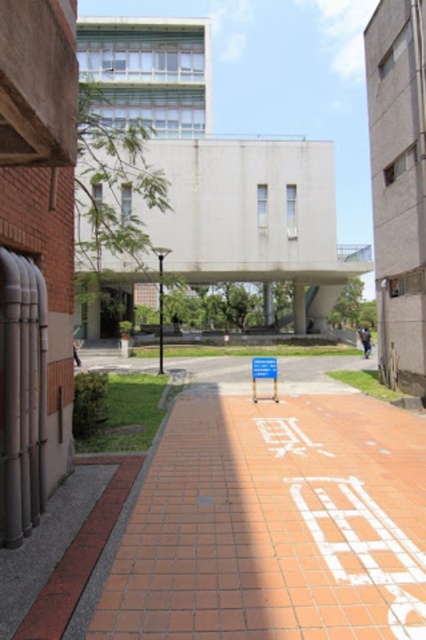
You are a maintenance worker needing to place a 10 meter long hose between the white painted brick at center and the blue plastic sign at center. Can you fit the hose between them without bending it?

The distance between the white painted brick at center and the blue plastic sign at center is 9.32 meters. Since the hose is 10 meters long, it is longer than the distance between them. Therefore, the hose cannot be placed straight between them without bending.

You are standing at the center of the pathway on the university campus. You see a point marked at coordinates [363,547]. What is located at that point?

At point [363,547] lies white painted brick at center.